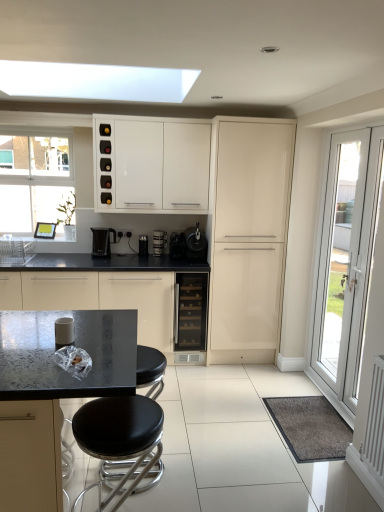
This screenshot has width=384, height=512. I want to click on vacant region above granite black table at center (from a real-world perspective), so click(x=74, y=349).